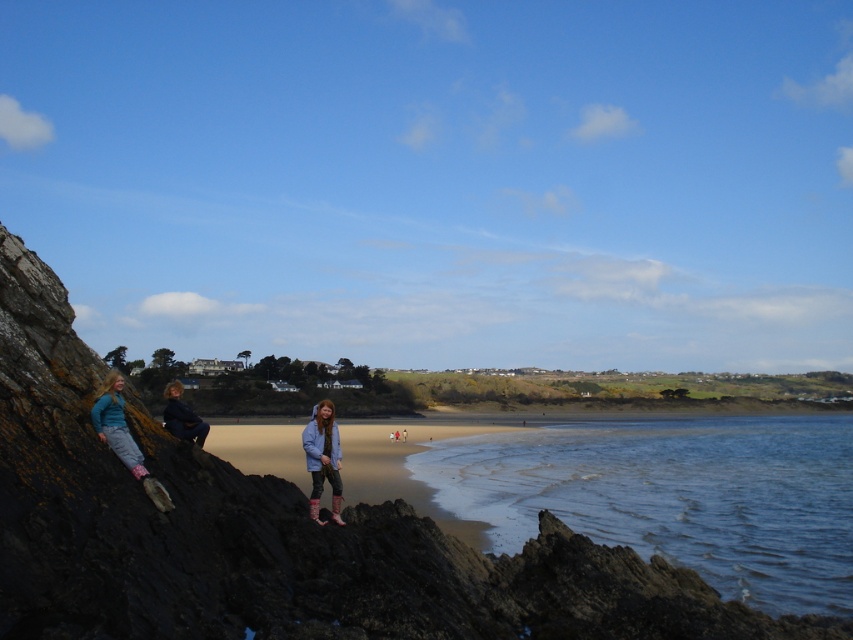
Is blue water at lower right to the left of brown sandy beach at center from the viewer's perspective?

In fact, blue water at lower right is to the right of brown sandy beach at center.

Is blue water at lower right smaller than brown sandy beach at center?

No, blue water at lower right is not smaller than brown sandy beach at center.

Where is `blue water at lower right`? The height and width of the screenshot is (640, 853). blue water at lower right is located at coordinates (675, 497).

Is point (326, 474) farther from camera compared to point (171, 396)?

That is False.

Find the location of a particular element. This screenshot has height=640, width=853. matte blue jacket at center is located at coordinates (323, 458).

Which is more to the right, blue water at lower right or matte black jacket at left?

blue water at lower right is more to the right.

Does point (550, 428) lie in front of point (198, 429)?

No, (550, 428) is further to viewer.

Identify the location of blue water at lower right. (675, 497).